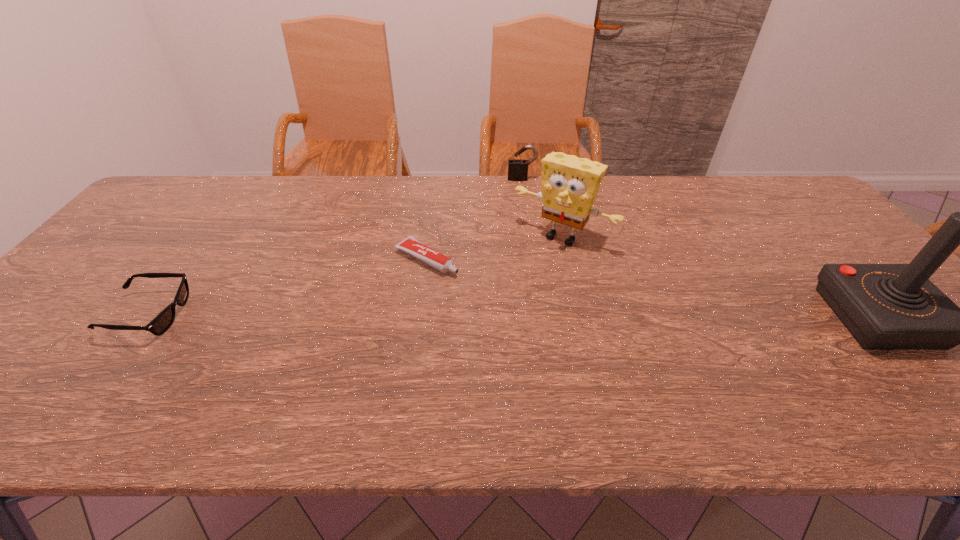
Where is `vacant space on the desktop that is between the leftmost object and the tallest object and is positioned at the nozzle of the toothpaste`? vacant space on the desktop that is between the leftmost object and the tallest object and is positioned at the nozzle of the toothpaste is located at coordinates pos(528,316).

Image resolution: width=960 pixels, height=540 pixels. I want to click on free spot on the desktop that is between the fourth tallest object and the tallest object and is positioned with the keyhole on the front of the third tallest object, so click(x=529, y=316).

Where is `free space on the desktop that is between the fourth tallest object and the joystick and is positioned on the face of the fourth shortest object`? Image resolution: width=960 pixels, height=540 pixels. free space on the desktop that is between the fourth tallest object and the joystick and is positioned on the face of the fourth shortest object is located at coordinates (505, 316).